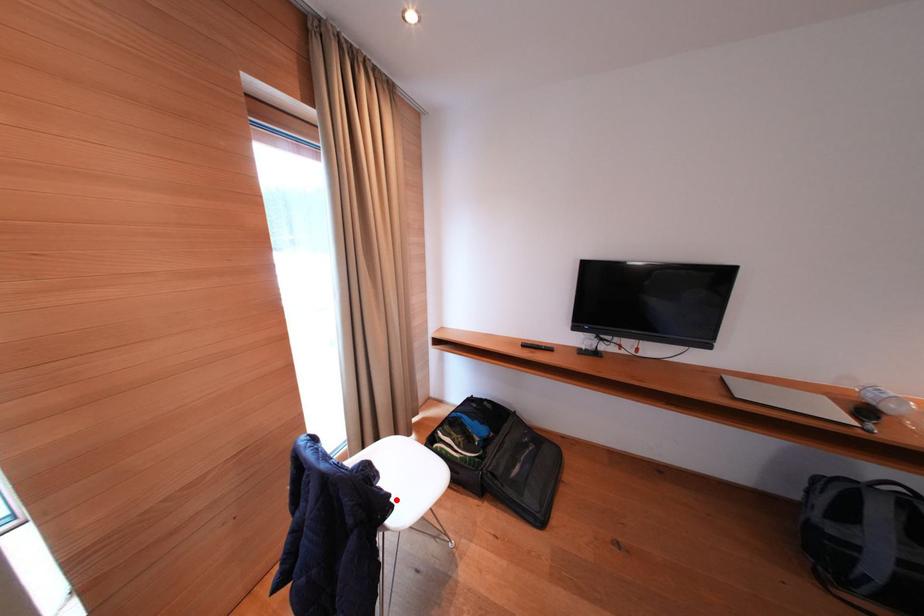
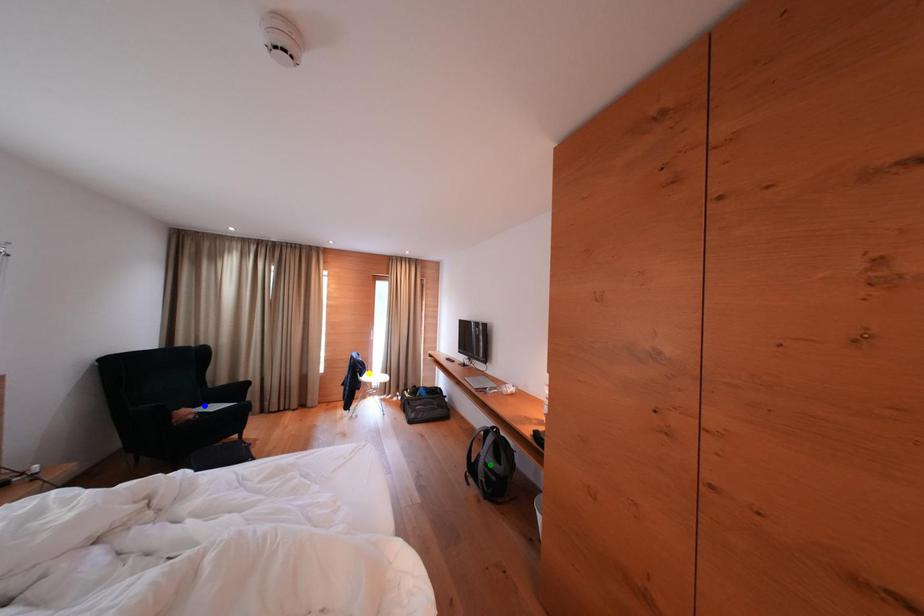
Question: I am providing you with two images of the same scene from different viewpoints. A red point is marked on the first image. You are given multiple points on the second image. Can you choose the point in image 2 that corresponds to the point in image 1?

Choices:
 (A) blue point
 (B) green point
 (C) yellow point

Answer: (C)